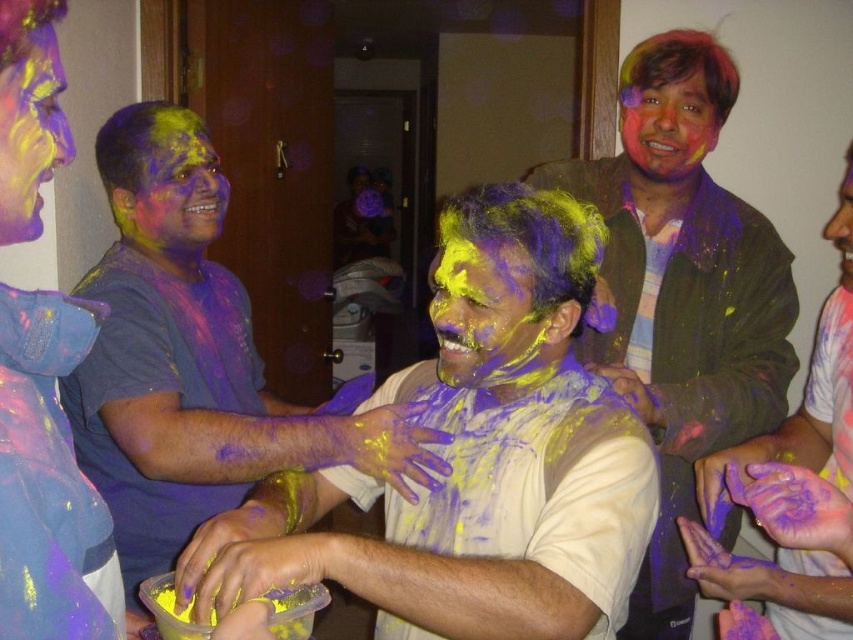
You are planning to take a photo of the matte purple shirt at center and the smooth skin face at upper right. Which object is wider in the image?

The matte purple shirt at center is wider than the smooth skin face at upper right.

Consider the image. You are a photographer standing in the room where the Holi celebration is happening. You want to take a photo that includes both the matte purple shirt at center and the smooth skin face at upper right. However, you can only focus on one object at a time. Which object should you focus on to ensure it appears clearer in the photo?

You should focus on the matte purple shirt at center because it is closer to the viewer than the smooth skin face at upper right. Objects closer to the camera are in focus while those further away may appear blurry.

You are organizing a Holi celebration and need to arrange two participants wearing the same color shirts. You have a matte purple shirt at center and a matte purple shirt at left. Based on their positions, which participant should stand in the front row for a group photo to ensure both are visible?

The matte purple shirt at center should stand in the front row because it is taller than the matte purple shirt at left, ensuring visibility without blocking each other.